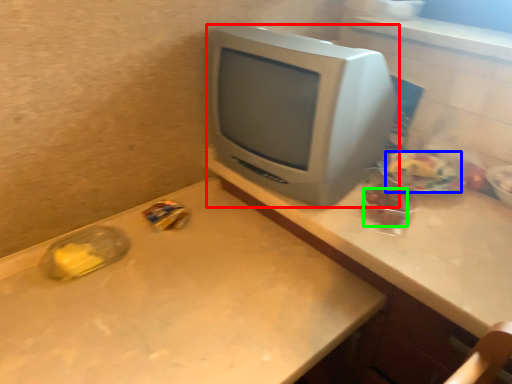
Question: Which is farther away from computer monitor (highlighted by a red box)? food (highlighted by a blue box) or food (highlighted by a green box)?

Choices:
 (A) food
 (B) food

Answer: (A)